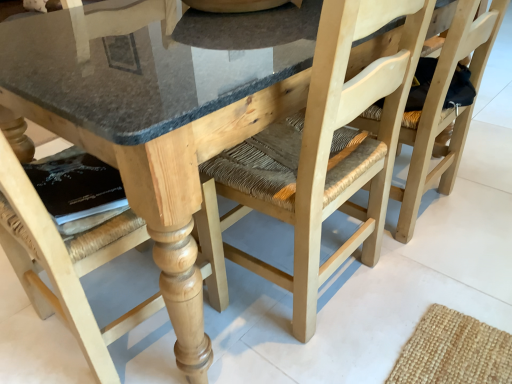
Where is `free space to the right of natural wood chair at center, acting as the 2th chair starting from the right`? free space to the right of natural wood chair at center, acting as the 2th chair starting from the right is located at coordinates (445, 289).